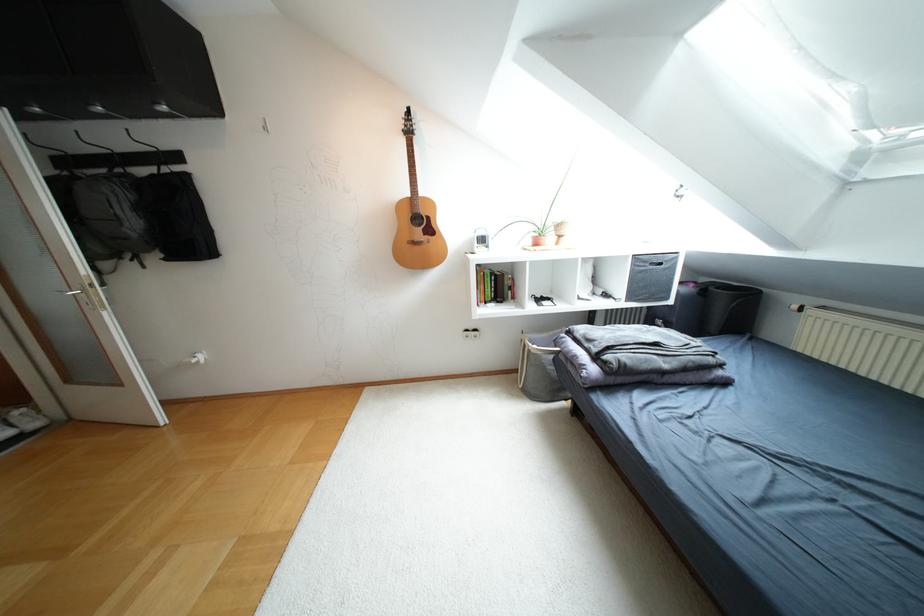
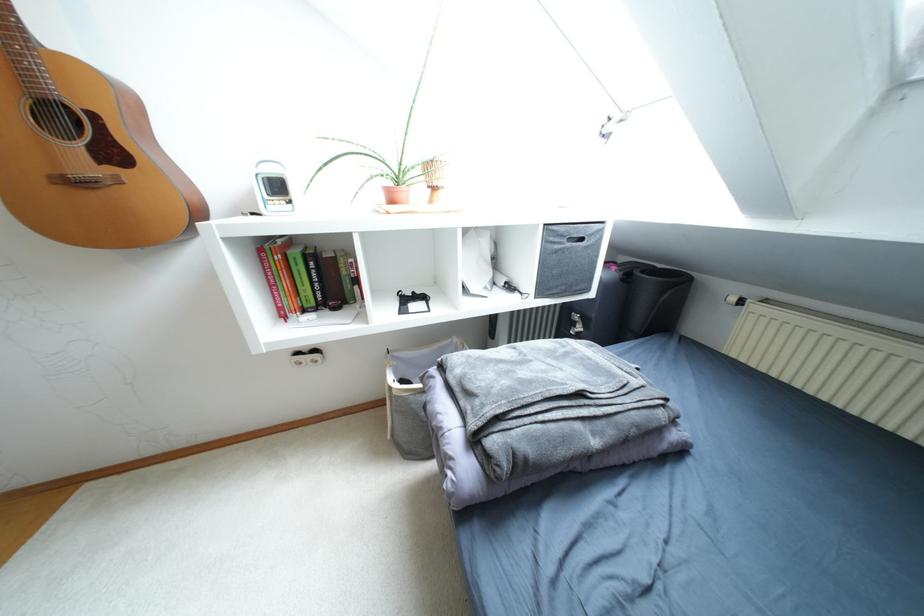
Question: The images are taken continuously from a first-person perspective. In which direction is your viewpoint rotating?

Choices:
 (A) Left
 (B) Right
 (C) Up
 (D) Down

Answer: (B)